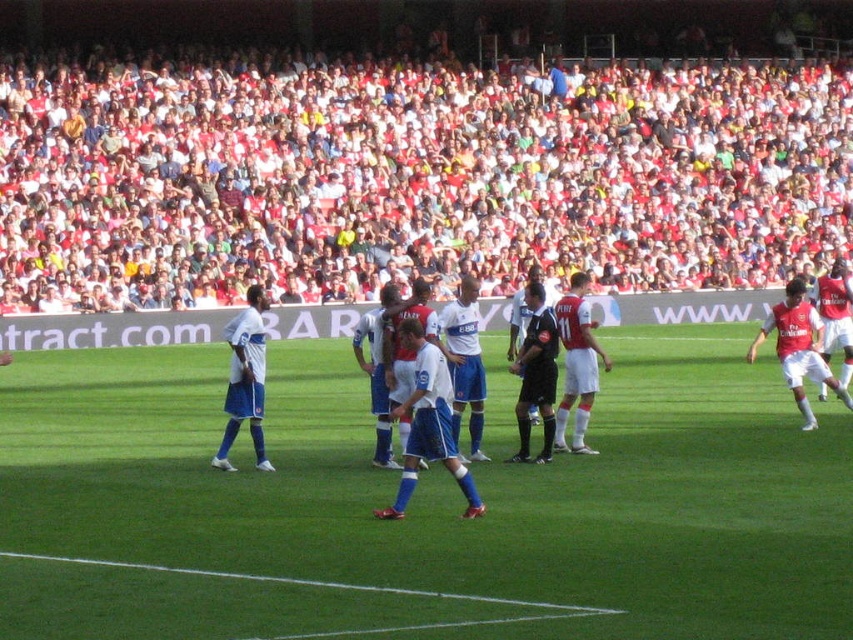
Based on the photo, can you confirm if white smooth soccer players at center is positioned to the left of white matte soccer player at left?

In fact, white smooth soccer players at center is to the right of white matte soccer player at left.

Is white smooth soccer players at center wider than white matte soccer player at left?

Yes, white smooth soccer players at center is wider than white matte soccer player at left.

Is point (407, 488) closer to viewer compared to point (242, 332)?

That is True.

I want to click on white smooth soccer players at center, so click(x=428, y=420).

Does green grass field at center have a larger size compared to white smooth soccer players at center?

Indeed, green grass field at center has a larger size compared to white smooth soccer players at center.

Between green grass field at center and white smooth soccer players at center, which one has more height?

white smooth soccer players at center

Is point (270, 605) positioned in front of point (426, 403)?

That is True.

This screenshot has height=640, width=853. I want to click on green grass field at center, so click(421, 508).

Does white cotton shirt at upper center have a greater height compared to white matte soccer player at left?

Yes.

The image size is (853, 640). Find the location of `white cotton shirt at upper center`. white cotton shirt at upper center is located at coordinates (408, 177).

Locate an element on the screen. The height and width of the screenshot is (640, 853). white cotton shirt at upper center is located at coordinates (408, 177).